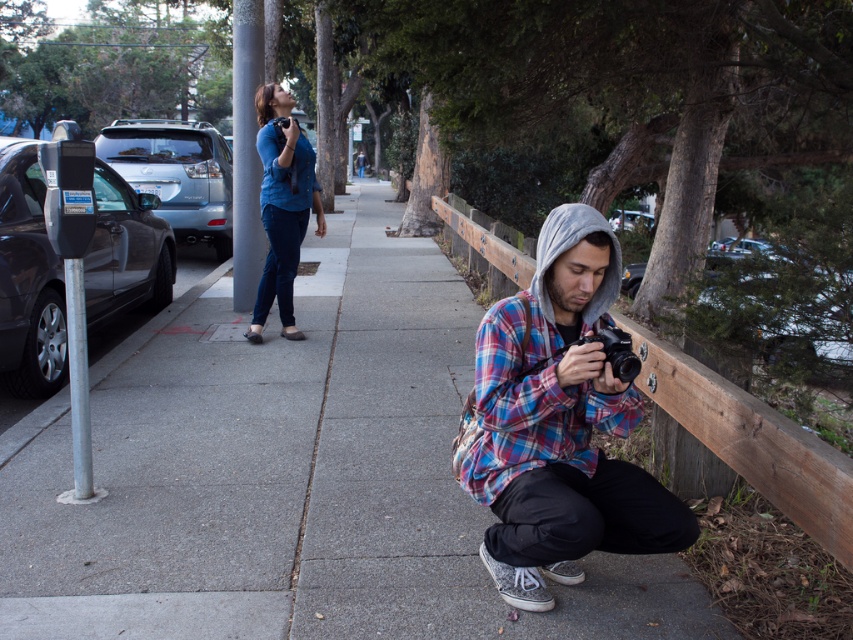
Is gray concrete pavement at center to the right of plaid flannel shirt at center from the viewer's perspective?

In fact, gray concrete pavement at center is to the left of plaid flannel shirt at center.

Does gray concrete pavement at center have a lesser width compared to plaid flannel shirt at center?

In fact, gray concrete pavement at center might be wider than plaid flannel shirt at center.

Locate an element on the screen. gray concrete pavement at center is located at coordinates (294, 477).

Find the location of a particular element. gray concrete pavement at center is located at coordinates (294, 477).

Is gray concrete pavement at center wider than matte black camera at lower center?

Indeed, gray concrete pavement at center has a greater width compared to matte black camera at lower center.

Between gray concrete pavement at center and matte black camera at lower center, which one has more height?

Standing taller between the two is gray concrete pavement at center.

The width and height of the screenshot is (853, 640). What are the coordinates of `gray concrete pavement at center` in the screenshot? It's located at (294, 477).

Between matte blue shirt at center and matte black camera at lower center, which one is positioned higher?

matte blue shirt at center

Between point (289, 220) and point (618, 355), which one is positioned in front?

Positioned in front is point (618, 355).

You are a GUI agent. You are given a task and a screenshot of the screen. Output one action in this format:
    pyautogui.click(x=<x>, y=<y>)
    Task: Click on the matte blue shirt at center
    The height and width of the screenshot is (640, 853).
    Given the screenshot: What is the action you would take?
    pyautogui.click(x=282, y=204)